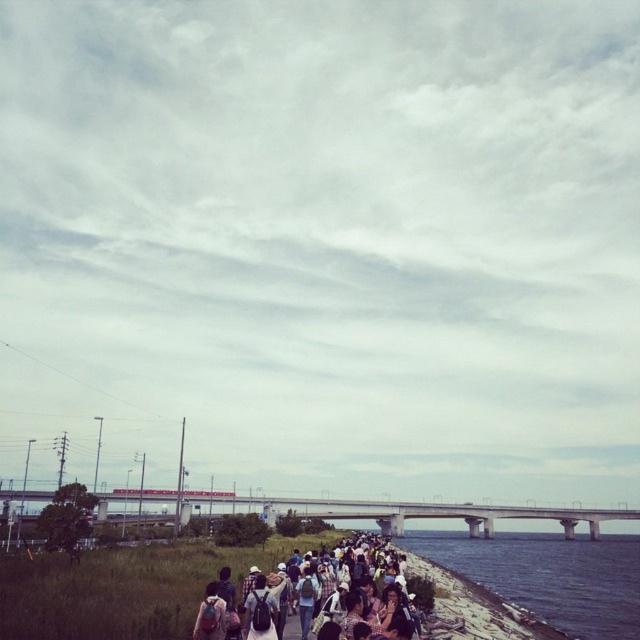
You are standing on the path and want to place your matte black backpack at center on the clear water at lower right. Is the backpack likely to stay afloat?

The clear water at lower right has a greater height compared to matte black backpack at center. Since the backpack is shorter than the water height, it might not stay afloat unless it is buoyant.

You are a hiker who wants to carry your matte black backpack at center across the concrete bridge at center. Considering their sizes, will the backpack fit comfortably on the bridge without any issues?

The matte black backpack at center is smaller than the concrete bridge at center, so it will fit comfortably on the bridge without any issues.

You are standing on the path and want to cross to the other side of the concrete bridge at center. However, there is clear water at lower right in your way. Which direction should you move to avoid the water?

The clear water at lower right is on the right side of the concrete bridge at center. To avoid the water, you should move to the left side of the concrete bridge at center.